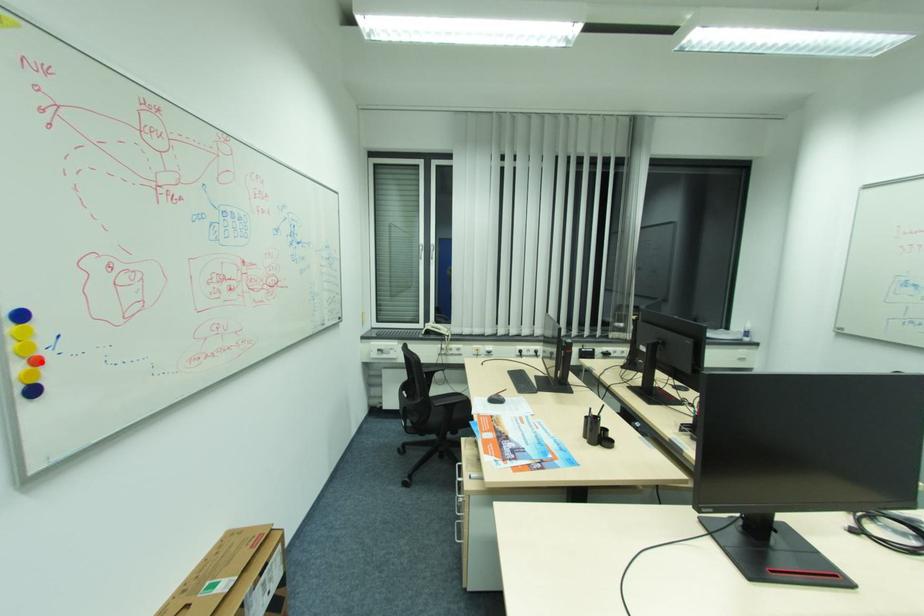
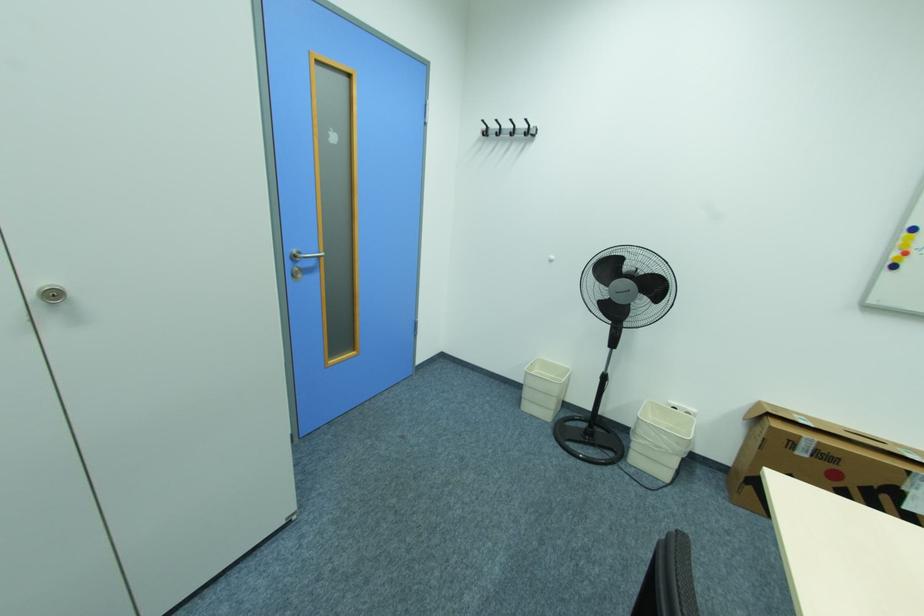
Where in the second image is the point corresponding to the highlighted location from the first image?

(910, 253)